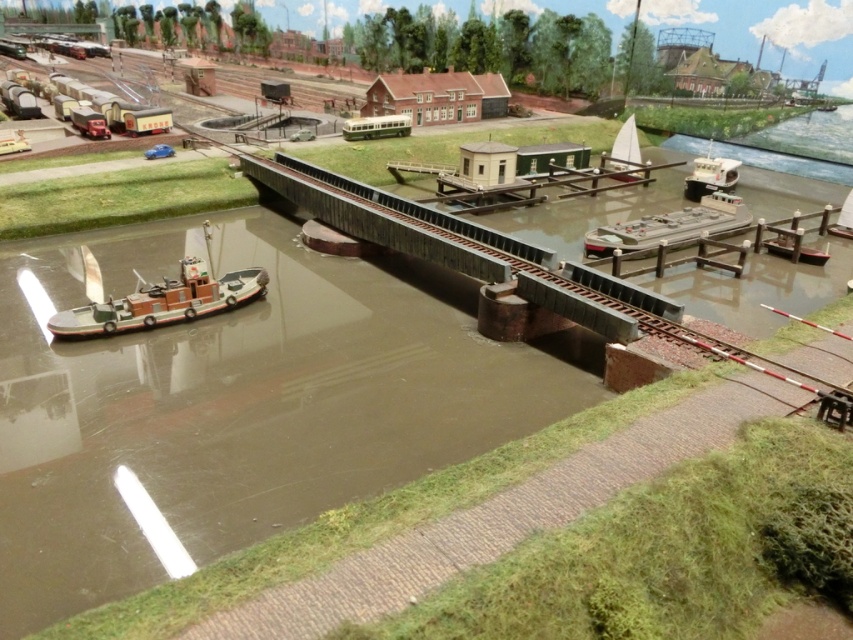
Does point (724, 189) come in front of point (842, 211)?

No, (724, 189) is further to viewer.

You are a GUI agent. You are given a task and a screenshot of the screen. Output one action in this format:
    pyautogui.click(x=<x>, y=<y>)
    Task: Click on the white plastic boat at upper right
    The image size is (853, 640).
    Given the screenshot: What is the action you would take?
    pyautogui.click(x=711, y=176)

Is white plastic boat at upper right to the left of white matte sailboat at upper center from the viewer's perspective?

In fact, white plastic boat at upper right is to the right of white matte sailboat at upper center.

Who is higher up, white plastic boat at upper right or white matte sailboat at upper center?

white matte sailboat at upper center is above.

From the picture: Measure the distance between point (718, 179) and camera.

The distance of point (718, 179) from camera is 42.39 meters.

Where is `white plastic boat at upper right`? white plastic boat at upper right is located at coordinates (711, 176).

Is brown matte waterway at center above brown wooden boat at lower left?

Actually, brown matte waterway at center is below brown wooden boat at lower left.

Image resolution: width=853 pixels, height=640 pixels. Describe the element at coordinates (231, 406) in the screenshot. I see `brown matte waterway at center` at that location.

Is point (367, 426) positioned in front of point (184, 296)?

Yes.

Locate an element on the screen. The width and height of the screenshot is (853, 640). brown matte waterway at center is located at coordinates (231, 406).